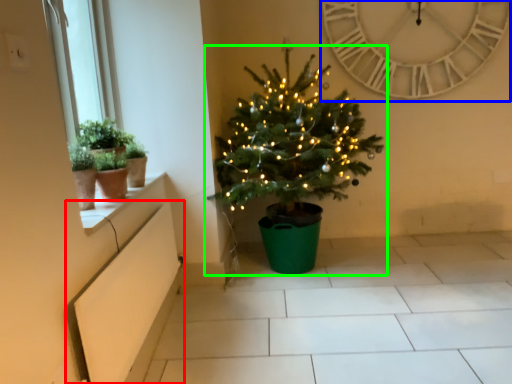
Question: Considering the real-world distances, which object is closest to window box (highlighted by a red box)? clock (highlighted by a blue box) or christmas tree (highlighted by a green box).

Choices:
 (A) clock
 (B) christmas tree

Answer: (B)